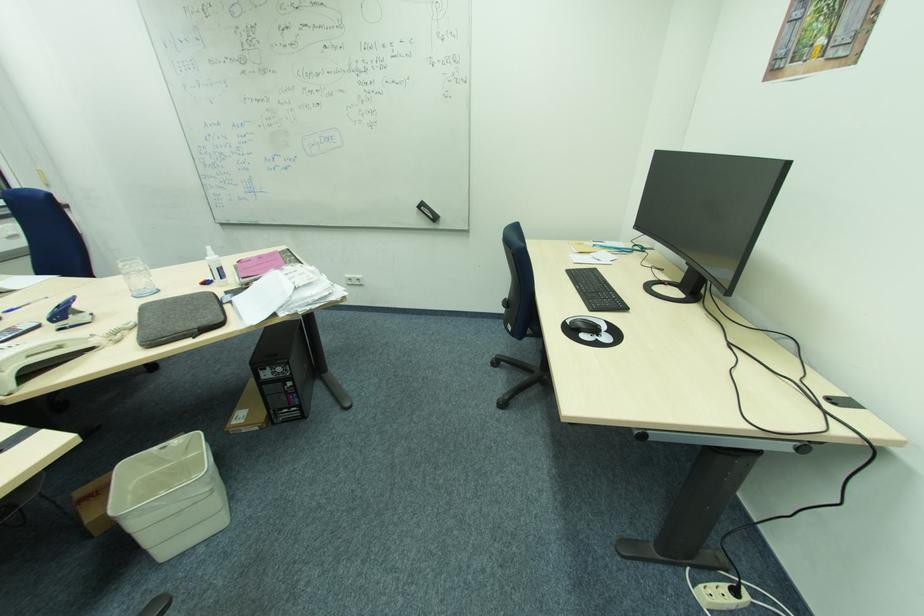
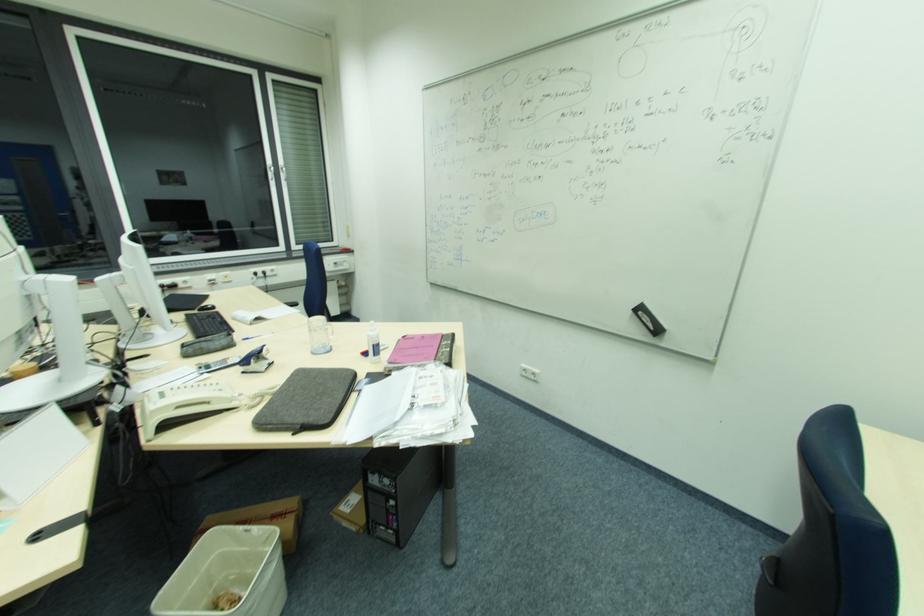
In the second image, find the point that corresponds to the point at 187,459 in the first image.

(263, 548)